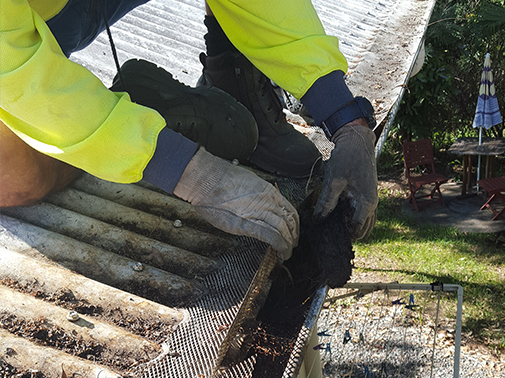
The height and width of the screenshot is (378, 505). Identify the location of screen. (209, 349).